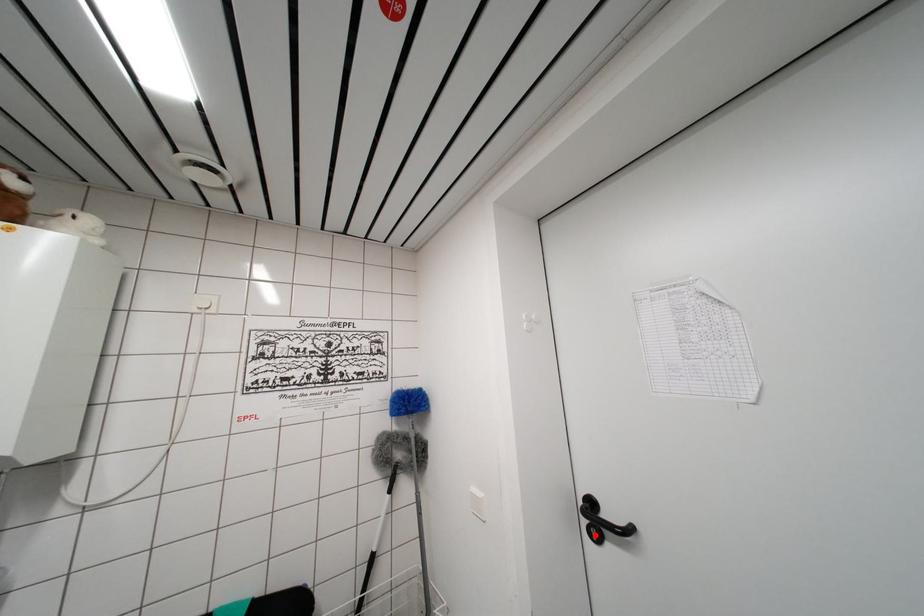
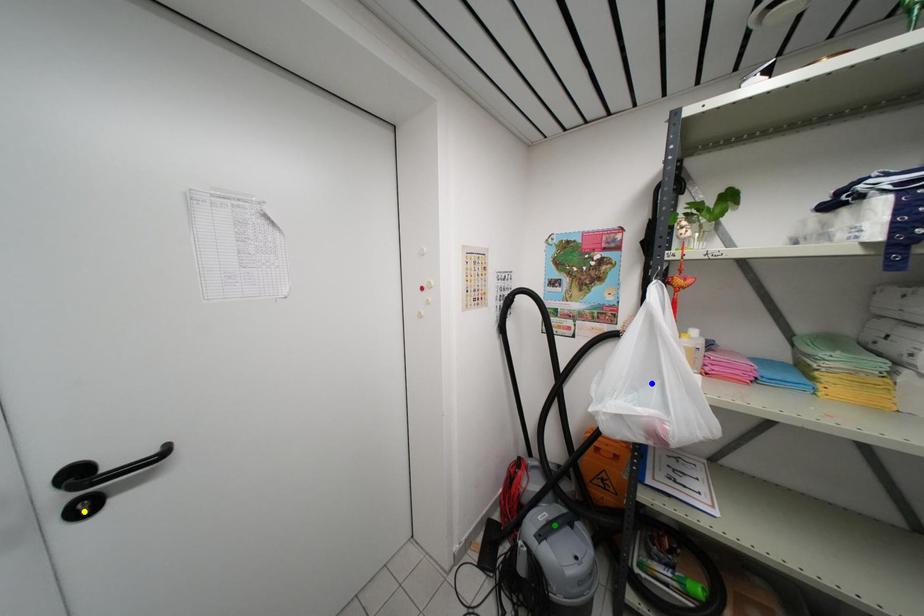
Question: I am providing you with two images of the same scene from different viewpoints. A red point is marked on the first image. You are given multiple points on the second image. Which point in image 2 is actually the same real-world point as the red point in image 1?

Choices:
 (A) blue point
 (B) green point
 (C) yellow point

Answer: (C)